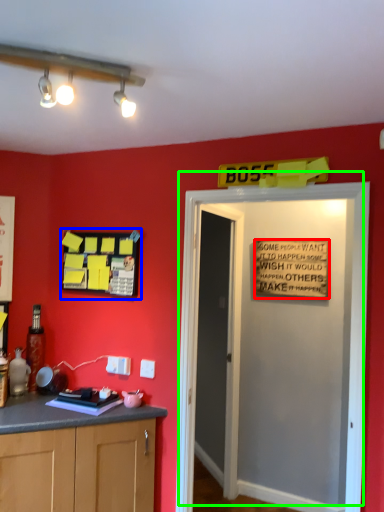
Question: Which is nearer to the warning sign (highlighted by a red box)? bulletin board (highlighted by a blue box) or door (highlighted by a green box).

Choices:
 (A) bulletin board
 (B) door

Answer: (B)